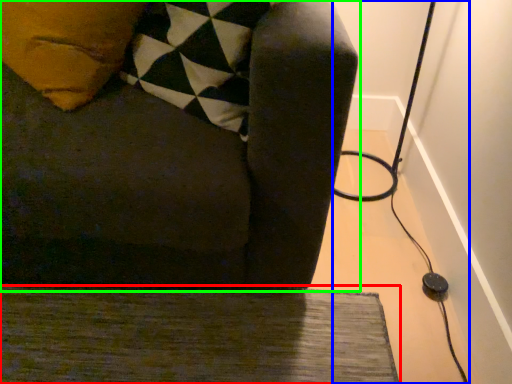
Question: Which is nearer to the doormat (highlighted by a red box)? cable (highlighted by a blue box) or furniture (highlighted by a green box).

Choices:
 (A) cable
 (B) furniture

Answer: (B)